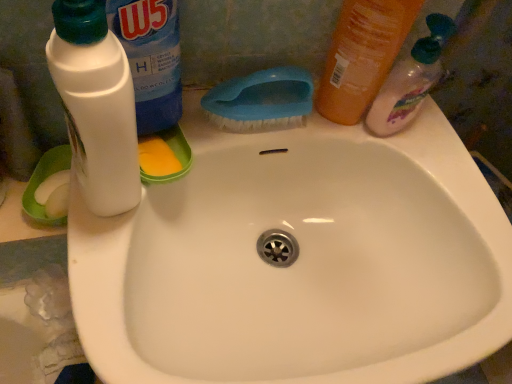
What are the coordinates of `vacant space to the right of translucent plastic bottle at upper right, which is the third cleaning product in left-to-right order` in the screenshot? It's located at (442, 145).